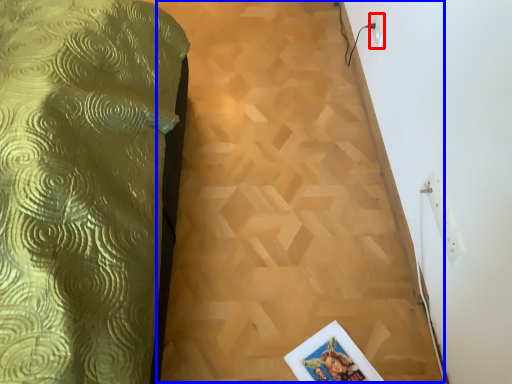
Question: Which object is further to the camera taking this photo, electric outlet (highlighted by a red box) or plywood (highlighted by a blue box)?

Choices:
 (A) electric outlet
 (B) plywood

Answer: (A)